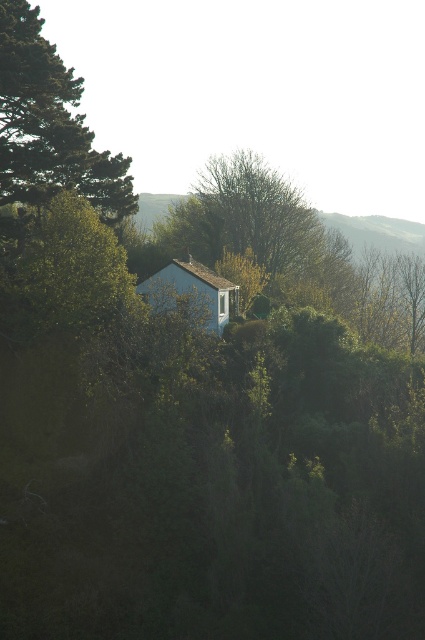
Question: Among these points, which one is nearest to the camera?

Choices:
 (A) (25, 154)
 (B) (220, 298)

Answer: (A)

Question: Does green leafy tree at left have a larger size compared to blue matte hut at center?

Choices:
 (A) yes
 (B) no

Answer: (A)

Question: Is green leafy tree at left above blue matte hut at center?

Choices:
 (A) yes
 (B) no

Answer: (A)

Question: Which point is farther to the camera?

Choices:
 (A) (189, 260)
 (B) (79, 177)

Answer: (A)

Question: Is green leafy tree at left positioned behind blue matte hut at center?

Choices:
 (A) no
 (B) yes

Answer: (B)